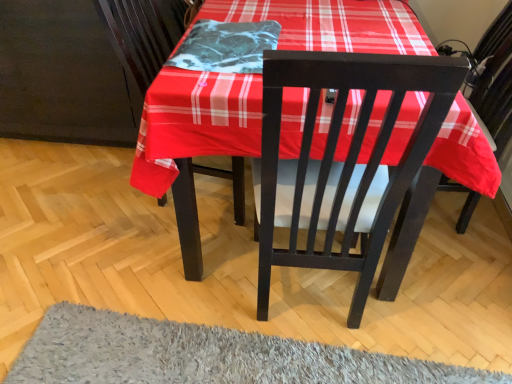
What do you see at coordinates (226, 46) in the screenshot? The height and width of the screenshot is (384, 512). I see `marble-like fabric at center` at bounding box center [226, 46].

What is the approximate width of marble-like fabric at center?

It is 12.42 inches.

Locate an element on the screen. This screenshot has height=384, width=512. marble-like fabric at center is located at coordinates (226, 46).

The image size is (512, 384). I want to click on gray shaggy rug at lower center, so click(205, 355).

The height and width of the screenshot is (384, 512). Describe the element at coordinates (205, 355) in the screenshot. I see `gray shaggy rug at lower center` at that location.

This screenshot has height=384, width=512. I want to click on marble-like fabric at center, so click(226, 46).

Between gray shaggy rug at lower center and marble-like fabric at center, which one appears on the right side from the viewer's perspective?

gray shaggy rug at lower center.

Consider the image. Does gray shaggy rug at lower center come behind marble-like fabric at center?

No, the depth of gray shaggy rug at lower center is less than that of marble-like fabric at center.

Which is less distant, (249,373) or (204,22)?

Point (249,373).

From the image's perspective, would you say gray shaggy rug at lower center is positioned over marble-like fabric at center?

No, from the image's perspective, gray shaggy rug at lower center is not above marble-like fabric at center.

From a real-world perspective, is gray shaggy rug at lower center positioned under marble-like fabric at center based on gravity?

Yes, from a real-world perspective, gray shaggy rug at lower center is below marble-like fabric at center.

Does gray shaggy rug at lower center have a greater width compared to marble-like fabric at center?

Indeed, gray shaggy rug at lower center has a greater width compared to marble-like fabric at center.

Who is taller, gray shaggy rug at lower center or marble-like fabric at center?

With more height is gray shaggy rug at lower center.

Which of these two, gray shaggy rug at lower center or marble-like fabric at center, is bigger?

With larger size is gray shaggy rug at lower center.

Would you say gray shaggy rug at lower center contains marble-like fabric at center?

That's incorrect, marble-like fabric at center is not inside gray shaggy rug at lower center.

Is there a large distance between gray shaggy rug at lower center and marble-like fabric at center?

No, gray shaggy rug at lower center is in close proximity to marble-like fabric at center.

Is marble-like fabric at center at the back of gray shaggy rug at lower center?

gray shaggy rug at lower center is not turned away from marble-like fabric at center.

What's the angular difference between gray shaggy rug at lower center and marble-like fabric at center's facing directions?

There is a 2.52-degree angle between the facing directions of gray shaggy rug at lower center and marble-like fabric at center.

Measure the distance between gray shaggy rug at lower center and marble-like fabric at center.

They are 91.84 centimeters apart.

Where is `mat below the marble-like fabric at center (from the image's perspective)`? mat below the marble-like fabric at center (from the image's perspective) is located at coordinates (205, 355).

Considering the positions of objects marble-like fabric at center and gray shaggy rug at lower center in the image provided, who is more to the right, marble-like fabric at center or gray shaggy rug at lower center?

Positioned to the right is gray shaggy rug at lower center.

Is the position of marble-like fabric at center more distant than that of gray shaggy rug at lower center?

Yes, it is.

Considering the positions of points (202, 62) and (510, 383), is point (202, 62) closer to camera compared to point (510, 383)?

That is True.

In the scene shown: From the image's perspective, between marble-like fabric at center and gray shaggy rug at lower center, who is located below?

gray shaggy rug at lower center.

From a real-world perspective, who is located lower, marble-like fabric at center or gray shaggy rug at lower center?

gray shaggy rug at lower center, from a real-world perspective.

Looking at their sizes, would you say marble-like fabric at center is wider or thinner than gray shaggy rug at lower center?

marble-like fabric at center is thinner than gray shaggy rug at lower center.

Is marble-like fabric at center taller or shorter than gray shaggy rug at lower center?

Clearly, marble-like fabric at center is shorter compared to gray shaggy rug at lower center.

Can you confirm if marble-like fabric at center is bigger than gray shaggy rug at lower center?

No, marble-like fabric at center is not bigger than gray shaggy rug at lower center.

Is marble-like fabric at center not inside gray shaggy rug at lower center?

Yes, marble-like fabric at center is located beyond the bounds of gray shaggy rug at lower center.

Is the surface of marble-like fabric at center in direct contact with gray shaggy rug at lower center?

A: marble-like fabric at center and gray shaggy rug at lower center are not in contact.

Is marble-like fabric at center turned away from gray shaggy rug at lower center?

→ No.

Can you tell me how much marble-like fabric at center and gray shaggy rug at lower center differ in facing direction?

The facing directions of marble-like fabric at center and gray shaggy rug at lower center are 2.52 degrees apart.

How distant is marble-like fabric at center from gray shaggy rug at lower center?

A distance of 36.16 inches exists between marble-like fabric at center and gray shaggy rug at lower center.

In order to click on blanket lying on the left of gray shaggy rug at lower center in this screenshot , I will do `click(226, 46)`.

In the image, there is a marble-like fabric at center. Where is `mat below it (from a real-world perspective)`? mat below it (from a real-world perspective) is located at coordinates (205, 355).

Locate an element on the screen. This screenshot has width=512, height=384. blanket on the left of gray shaggy rug at lower center is located at coordinates (226, 46).